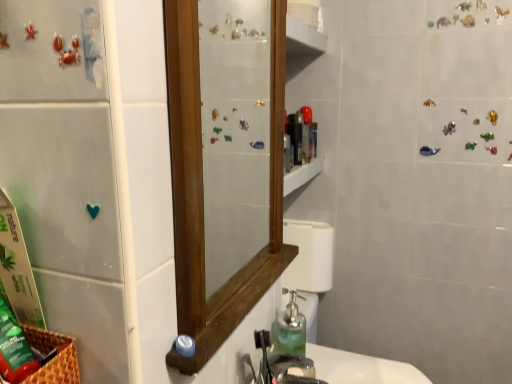
Question: Does metallic silver faucet at sink center have a lesser height compared to translucent glass soap dispenser at lower center?

Choices:
 (A) yes
 (B) no

Answer: (A)

Question: Can you confirm if metallic silver faucet at sink center is smaller than translucent glass soap dispenser at lower center?

Choices:
 (A) yes
 (B) no

Answer: (B)

Question: Is there a large distance between metallic silver faucet at sink center and translucent glass soap dispenser at lower center?

Choices:
 (A) yes
 (B) no

Answer: (B)

Question: Is metallic silver faucet at sink center positioned with its back to translucent glass soap dispenser at lower center?

Choices:
 (A) no
 (B) yes

Answer: (A)

Question: Does metallic silver faucet at sink center contain translucent glass soap dispenser at lower center?

Choices:
 (A) yes
 (B) no

Answer: (B)

Question: From the image's perspective, relative to white glossy sink at lower center, the 2th sink from the front, is metallic silver faucet at sink center above or below?

Choices:
 (A) below
 (B) above

Answer: (B)

Question: Considering their positions, is metallic silver faucet at sink center located in front of or behind white glossy sink at lower center, the 2th sink from the front?

Choices:
 (A) behind
 (B) front

Answer: (B)

Question: Choose the correct answer: Is metallic silver faucet at sink center inside white glossy sink at lower center, the 2th sink from the front, or outside it?

Choices:
 (A) inside
 (B) outside

Answer: (B)

Question: Visually, is metallic silver faucet at sink center positioned to the left or to the right of white glossy sink at lower center, which is the first sink in back-to-front order?

Choices:
 (A) left
 (B) right

Answer: (A)

Question: From the image's perspective, is metallic silver faucet at sink center above or below translucent glass soap dispenser at lower center?

Choices:
 (A) below
 (B) above

Answer: (A)

Question: In terms of height, does metallic silver faucet at sink center look taller or shorter compared to translucent glass soap dispenser at lower center?

Choices:
 (A) tall
 (B) short

Answer: (B)

Question: Based on their sizes in the image, would you say metallic silver faucet at sink center is bigger or smaller than translucent glass soap dispenser at lower center?

Choices:
 (A) big
 (B) small

Answer: (A)

Question: Is metallic silver faucet at sink center in front of or behind translucent glass soap dispenser at lower center in the image?

Choices:
 (A) front
 (B) behind

Answer: (A)

Question: From a real-world perspective, is translucent plastic container at upper center physically located above or below translucent glass soap dispenser at lower center?

Choices:
 (A) above
 (B) below

Answer: (A)

Question: In terms of size, does translucent plastic container at upper center appear bigger or smaller than translucent glass soap dispenser at lower center?

Choices:
 (A) small
 (B) big

Answer: (A)